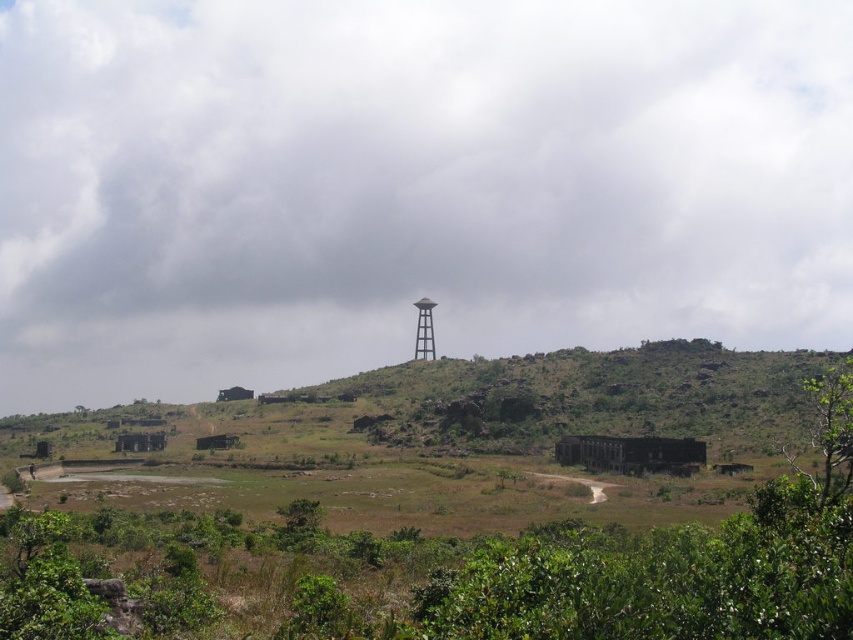
Question: Among these objects, which one is farthest from the camera?

Choices:
 (A) green leafy tree at lower left
 (B) green leafy tree at lower right

Answer: (A)

Question: Which point is closer to the camera?

Choices:
 (A) (422, 326)
 (B) (850, 429)
 (C) (303, 529)

Answer: (B)

Question: Does green leafy tree at lower right have a larger size compared to green leafy tree at lower left?

Choices:
 (A) yes
 (B) no

Answer: (A)

Question: Is green leafy tree at lower right above green leafy tree at lower left?

Choices:
 (A) yes
 (B) no

Answer: (A)

Question: Among these objects, which one is farthest from the camera?

Choices:
 (A) metallic gray observation tower at center
 (B) green leafy tree at lower left

Answer: (A)

Question: Is green leafy tree at lower right above metallic gray observation tower at center?

Choices:
 (A) yes
 (B) no

Answer: (B)